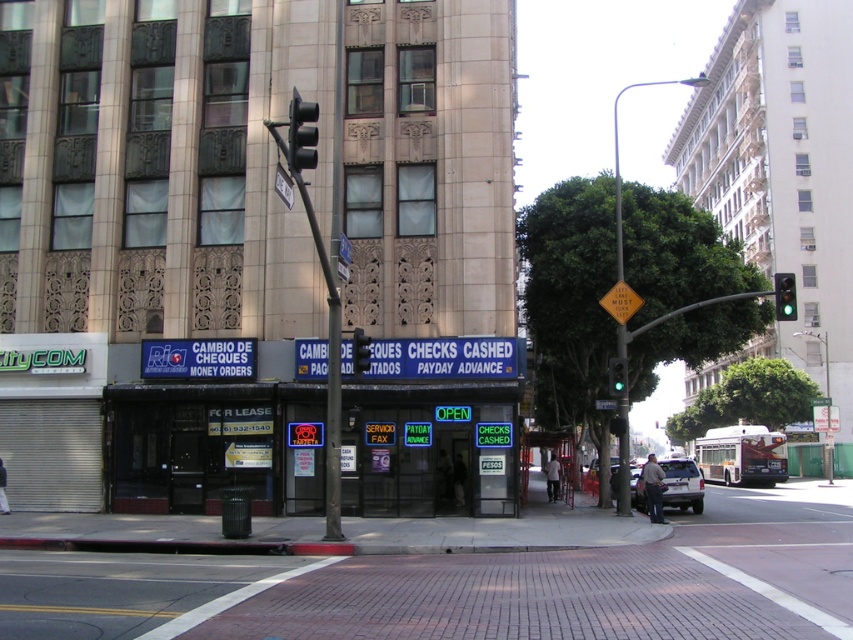
Does silver metallic suv at center come in front of green glass traffic light at center?

That is True.

Does silver metallic suv at center have a greater width compared to green glass traffic light at center?

Yes.

The image size is (853, 640). Find the location of `silver metallic suv at center`. silver metallic suv at center is located at coordinates (682, 484).

In order to click on silver metallic suv at center in this screenshot , I will do point(682,484).

Can you confirm if green glass traffic light at upper right is positioned to the left of metallic traffic light at center?

In fact, green glass traffic light at upper right is to the right of metallic traffic light at center.

Between green glass traffic light at upper right and metallic traffic light at center, which one has less height?

With less height is metallic traffic light at center.

Does point (782, 278) come farther from viewer compared to point (360, 340)?

That is True.

Where is `green glass traffic light at upper right`? This screenshot has height=640, width=853. green glass traffic light at upper right is located at coordinates (784, 296).

Measure the distance between brick pavement at lower center and metallic traffic light at center.

The distance of brick pavement at lower center from metallic traffic light at center is 8.09 meters.

Between point (344, 630) and point (363, 355), which one is positioned behind?

Positioned behind is point (363, 355).

The height and width of the screenshot is (640, 853). Find the location of `brick pavement at lower center`. brick pavement at lower center is located at coordinates (474, 586).